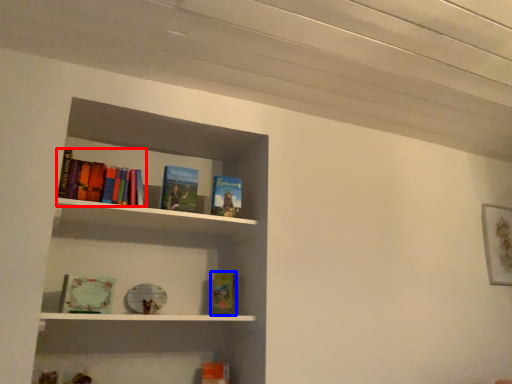
Question: Which object appears farthest to the camera in this image, book (highlighted by a red box) or book (highlighted by a blue box)?

Choices:
 (A) book
 (B) book

Answer: (B)